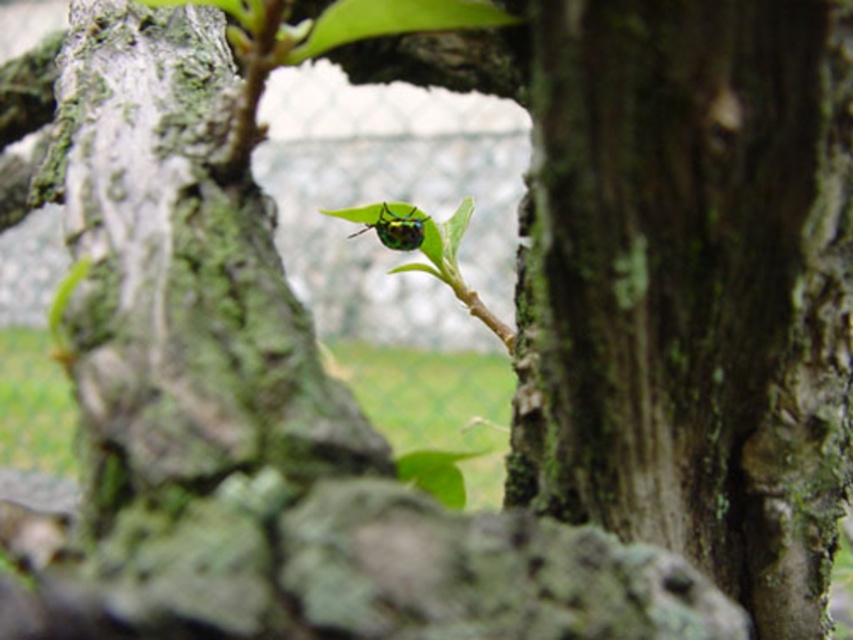
You are a photographer adjusting your camera to focus on two points in the image. The first point is point (819, 67) and the second is point (381, 218). Which point should you focus on first if you want to capture the closest object in the scene?

Point (819, 67) is closer to the camera than point (381, 218), so you should focus on point (819, 67) first to capture the closest object in the scene.

You are taking a photo of a tree trunk with a small insect on a leaf. Your camera has a focus range of 18 to 22 inches. Will the point at coordinates point (715, 332) be in focus?

The point at coordinates point (715, 332) is 20.38 inches from the camera, which falls within the focus range of 18 to 22 inches. Therefore, the point will be in focus.

You are a photographer trying to capture a close shot of the metallic green beetle at center. The green mossy bark at center is blocking part of your view. Can you move the beetle to the side to get a better shot?

The green mossy bark at center is much taller than the metallic green beetle at center, so moving the beetle might not help as the bark is significantly taller and could still block the view.